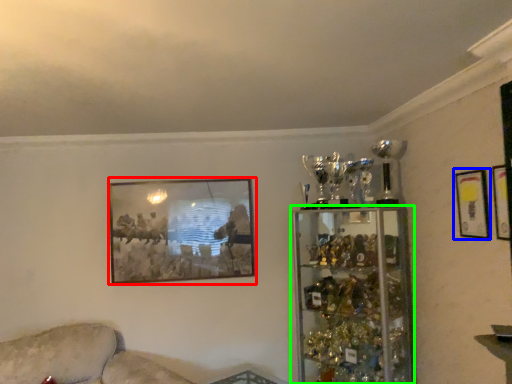
Question: Which is farther away from picture frame (highlighted by a red box)? picture frame (highlighted by a blue box) or shelf (highlighted by a green box)?

Choices:
 (A) picture frame
 (B) shelf

Answer: (A)